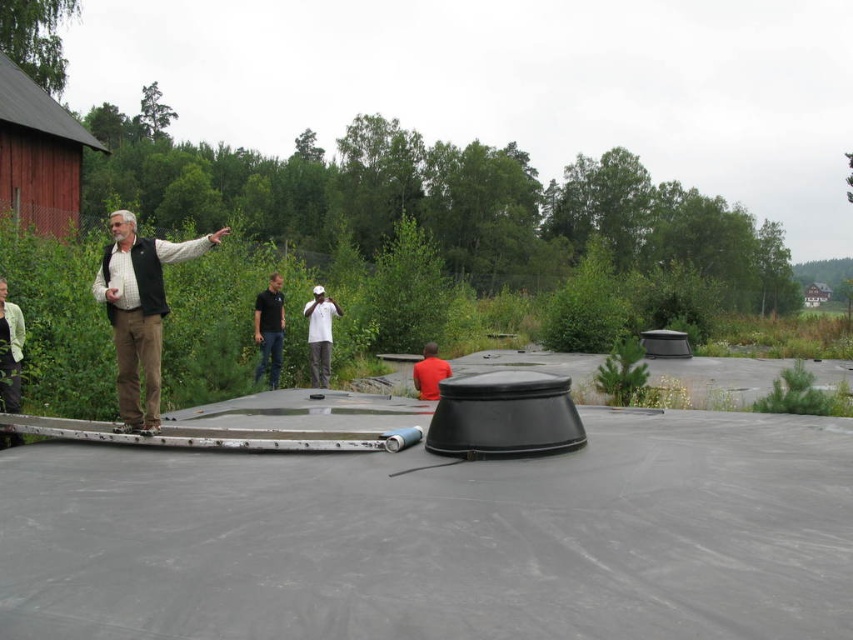
Question: Is light brown vest at center thinner than white matte baseball cap at center?

Choices:
 (A) yes
 (B) no

Answer: (B)

Question: Estimate the real-world distances between objects in this image. Which object is closer to the light brown vest at center?

Choices:
 (A) dark blue shirt at center
 (B) red matte shirt at center
 (C) light green fabric vest at left
 (D) white matte baseball cap at center

Answer: (C)

Question: Among these objects, which one is nearest to the camera?

Choices:
 (A) light green fabric vest at left
 (B) red matte shirt at center
 (C) dark blue shirt at center

Answer: (A)

Question: From the image, what is the correct spatial relationship of dark blue shirt at center in relation to white matte baseball cap at center?

Choices:
 (A) left
 (B) right

Answer: (A)

Question: Does dark blue shirt at center have a smaller size compared to red matte shirt at center?

Choices:
 (A) yes
 (B) no

Answer: (B)

Question: Which point is farther to the camera?

Choices:
 (A) dark blue shirt at center
 (B) light green fabric vest at left
 (C) white matte baseball cap at center

Answer: (C)